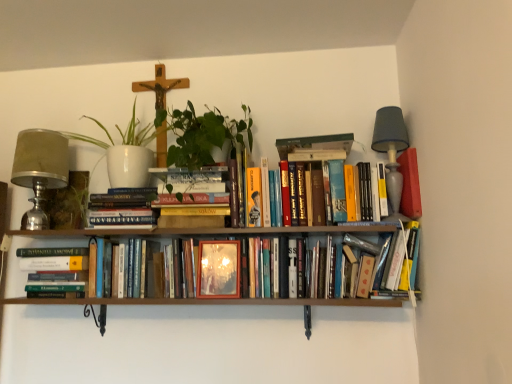
Question: From a real-world perspective, is gray fabric lampshade at upper right, the first table lamp positioned from the right, located higher than matte silver table lamp at left, arranged as the 1th table lamp when viewed from the left?

Choices:
 (A) yes
 (B) no

Answer: (A)

Question: Can you confirm if gray fabric lampshade at upper right, which ranks as the 2th table lamp in left-to-right order, is thinner than matte silver table lamp at left, arranged as the 1th table lamp when viewed from the left?

Choices:
 (A) no
 (B) yes

Answer: (A)

Question: Is gray fabric lampshade at upper right, which ranks as the 2th table lamp in left-to-right order, positioned with its back to matte silver table lamp at left, the second table lamp viewed from the right?

Choices:
 (A) yes
 (B) no

Answer: (B)

Question: Does gray fabric lampshade at upper right, the first table lamp positioned from the right, lie in front of matte silver table lamp at left, arranged as the 1th table lamp when viewed from the left?

Choices:
 (A) yes
 (B) no

Answer: (A)

Question: Can you confirm if gray fabric lampshade at upper right, which ranks as the 2th table lamp in left-to-right order, is positioned to the left of matte silver table lamp at left, arranged as the 1th table lamp when viewed from the left?

Choices:
 (A) no
 (B) yes

Answer: (A)

Question: Is gray fabric lampshade at upper right, the first table lamp positioned from the right, located outside matte silver table lamp at left, the second table lamp viewed from the right?

Choices:
 (A) yes
 (B) no

Answer: (A)

Question: Is green matte vase at left outside of matte silver table lamp at left, the second table lamp viewed from the right?

Choices:
 (A) no
 (B) yes

Answer: (A)

Question: From a real-world perspective, is green matte vase at left physically below matte silver table lamp at left, the second table lamp viewed from the right?

Choices:
 (A) yes
 (B) no

Answer: (A)

Question: Is matte silver table lamp at left, the second table lamp viewed from the right, surrounded by green matte vase at left?

Choices:
 (A) yes
 (B) no

Answer: (B)

Question: Would you say green matte vase at left is a long distance from matte silver table lamp at left, arranged as the 1th table lamp when viewed from the left?

Choices:
 (A) no
 (B) yes

Answer: (A)

Question: Can you confirm if green matte vase at left is smaller than matte silver table lamp at left, arranged as the 1th table lamp when viewed from the left?

Choices:
 (A) yes
 (B) no

Answer: (A)

Question: Can you confirm if green matte vase at left is wider than matte silver table lamp at left, arranged as the 1th table lamp when viewed from the left?

Choices:
 (A) no
 (B) yes

Answer: (A)

Question: Does matte wooden frame at center have a lesser width compared to green matte vase at left?

Choices:
 (A) no
 (B) yes

Answer: (B)